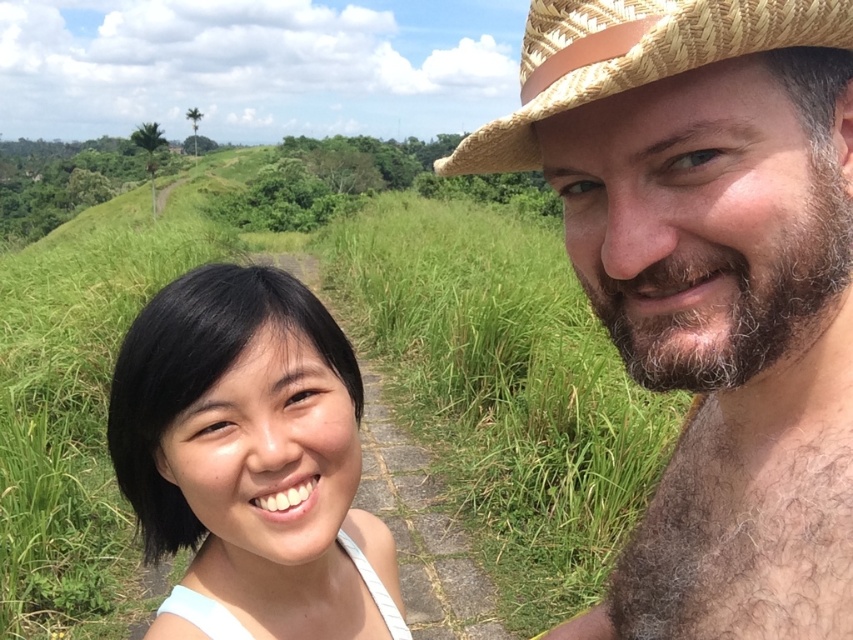
You are a photographer standing at the center of the image. You want to place a brown woven cowboy hat at upper right and green grass at center in your photo. Can you fit both objects in the frame if your camera has a 3 meter wide field of view?

The brown woven cowboy hat at upper right and green grass at center are 3.25 meters apart from each other. Since the distance between them exceeds the camera field of view by 0.25 meters, the camera cannot capture both objects in a single frame.

You are a photographer trying to capture a closeup of the black hair at center and the brown woven cowboy hat at upper right. Since you want to focus on both objects equally, which one should you zoom in on more to ensure they appear the same size in the photo?

The black hair at center is wider than the brown woven cowboy hat at upper right. To make them appear the same size in the photo, you should zoom in more on the brown woven cowboy hat at upper right since it is smaller.